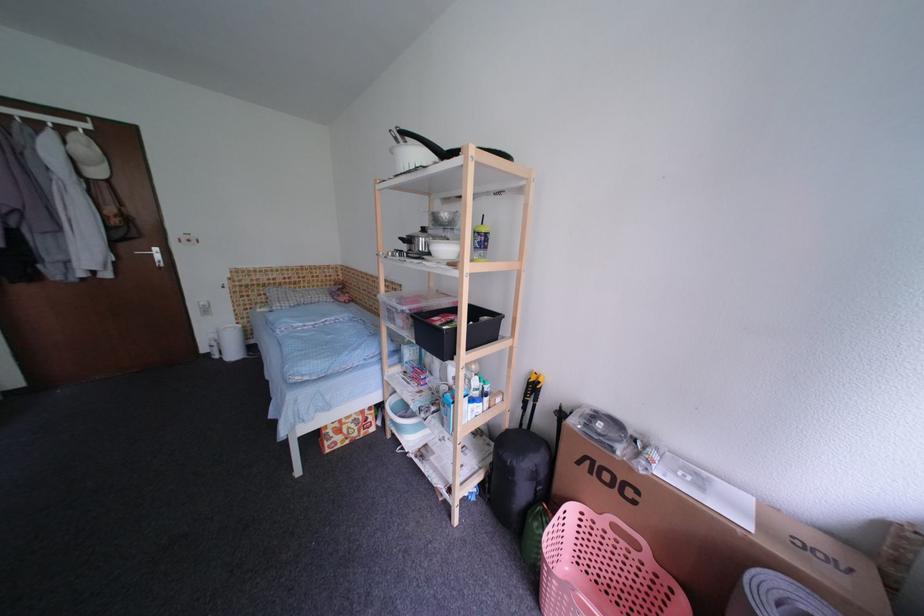
The location [444,249] corresponds to which object?

This point indicates the white bowl.